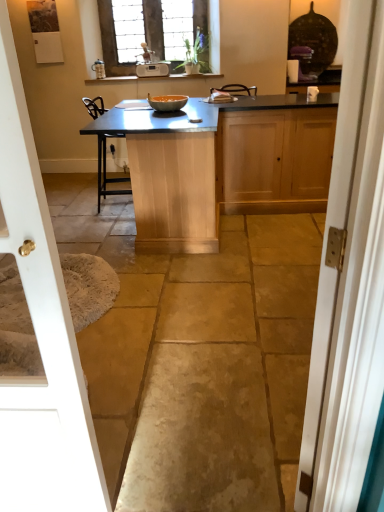
Identify the location of free space behind white painted wood door at right, arranged as the 1th door when viewed from the right. This screenshot has width=384, height=512. (266, 378).